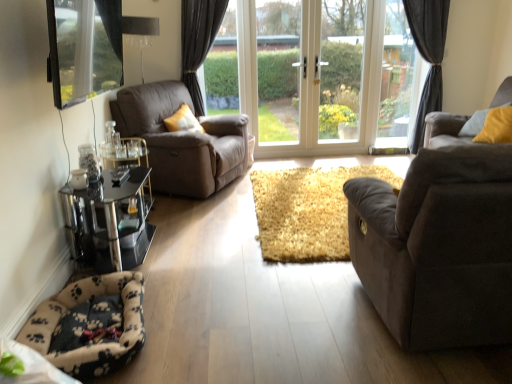
Identify the location of vacant area that is in front of matte brown leather armchair at left. (193, 223).